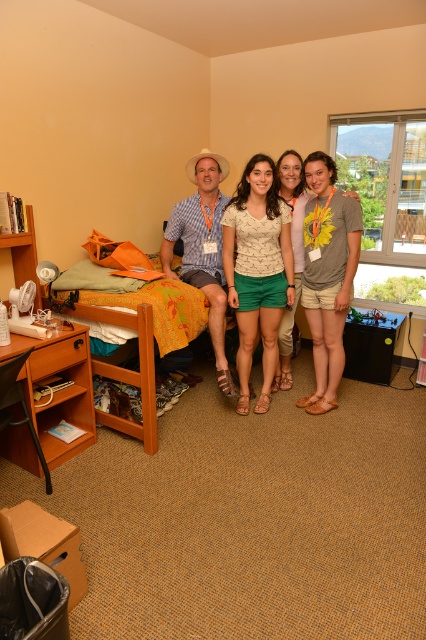
Question: Among these points, which one is farthest from the camera?

Choices:
 (A) (124, 300)
 (B) (173, 216)
 (C) (247, 305)
 (D) (290, 262)

Answer: (B)

Question: Which point appears farthest from the camera in this image?

Choices:
 (A) (149, 292)
 (B) (224, 202)

Answer: (B)

Question: Is matte yellow hat at center above wooden bed at left?

Choices:
 (A) no
 (B) yes

Answer: (B)

Question: Can you confirm if matte white shirt at center is positioned to the left of matte yellow hat at center?

Choices:
 (A) no
 (B) yes

Answer: (A)

Question: Can you confirm if matte white shirt at center is thinner than wooden bed at left?

Choices:
 (A) yes
 (B) no

Answer: (A)

Question: Which is nearer to the matte yellow hat at center?

Choices:
 (A) matte white blouse at center
 (B) wooden bed at left
 (C) matte white shirt at center

Answer: (C)